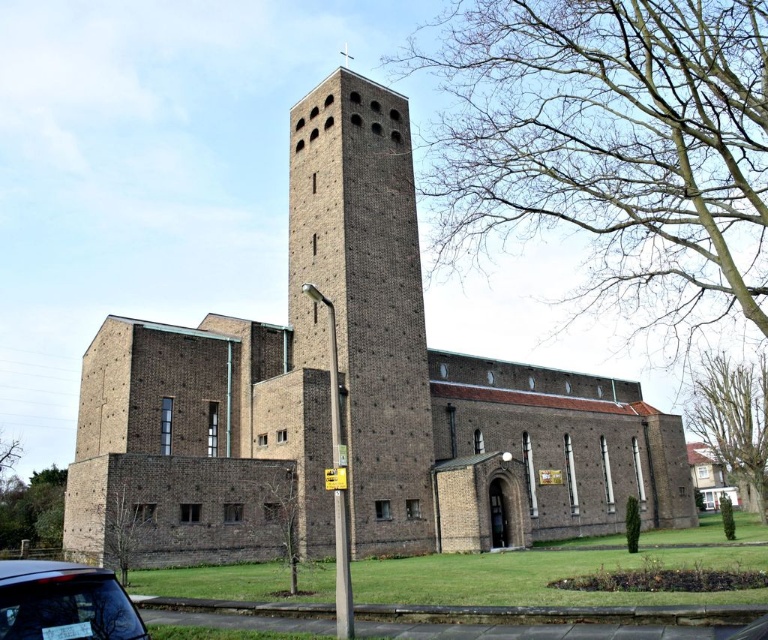
You are a visitor arriving at the church parking lot. You see the brown brick church at center and the matte black car at lower left. Which direction should you walk to reach the church from your current position near the car?

You should walk to the right to reach the brown brick church at center from the matte black car at lower left since the church is positioned on the right side of the car.

You are standing at the entrance of the modernist church and want to take a photo of the brown brick tower at center. Given that the entrance is at point 0.0, 0.0, can you determine if the tower is within the camera frame which has a maximum viewing range of 0.5 units in any direction?

The brown brick tower at center is located at point (363, 298). Since the entrance is at (0, 0) and the camera can view up to 0.5 units in any direction, the tower is within the frame as its coordinates are within the 0.5 radius from the entrance.

You are standing in front of the brown brick church at center and want to take a photo of the matte black car at lower left. Which object is closer to you to frame in your shot?

The brown brick church at center is closer to you than the matte black car at lower left, so you should frame the brown brick church at center first before focusing on the matte black car at lower left.